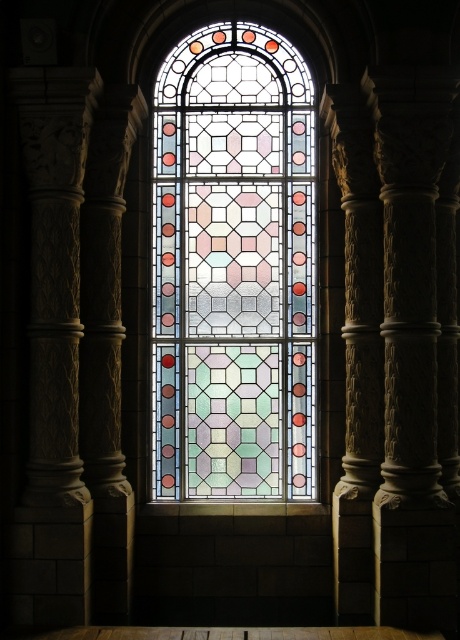
At what (x,y) coordinates should I click in order to perform the action: click on stained glass window at center. Please return your answer as a coordinate pair (x, y). This screenshot has width=460, height=640. Looking at the image, I should click on (234, 268).

Does point (262, 49) come closer to viewer compared to point (128, 106)?

No, (262, 49) is further to viewer.

Locate an element on the screen. This screenshot has height=640, width=460. stained glass window at center is located at coordinates (234, 268).